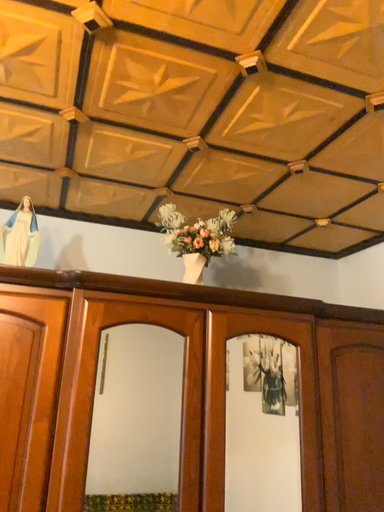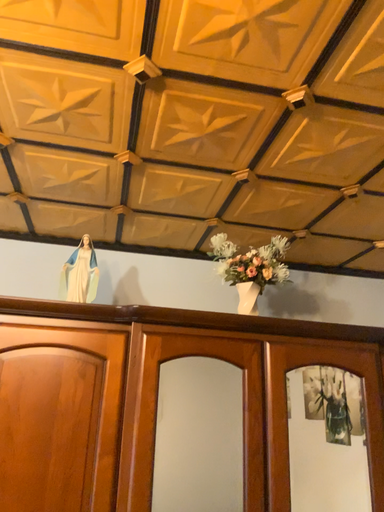
Question: How did the camera likely rotate when shooting the video?

Choices:
 (A) rotated right
 (B) rotated left

Answer: (B)